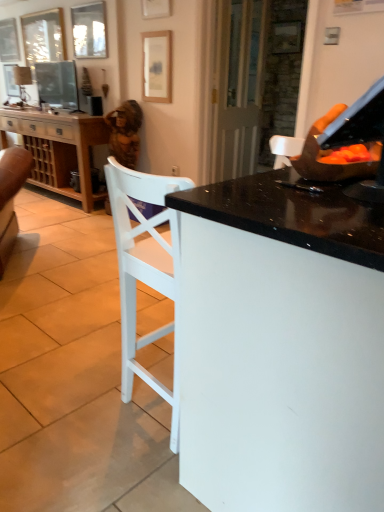
Locate an element on the screen. This screenshot has width=384, height=512. wooden picture frame at upper left, the 1th picture frame from the left is located at coordinates (9, 41).

This screenshot has height=512, width=384. What do you see at coordinates (58, 148) in the screenshot?
I see `wooden cabinet at left` at bounding box center [58, 148].

In order to face matte black television at upper left, should I rotate leftwards or rightwards?

Turn left approximately 17.220 degrees to face it.

What do you see at coordinates (156, 66) in the screenshot? I see `matte wooden picture frame at upper center, the 2th picture frame from the front` at bounding box center [156, 66].

This screenshot has width=384, height=512. What are the coordinates of `wooden picture frame at upper left, the first picture frame positioned from the back` in the screenshot? It's located at pyautogui.click(x=9, y=41).

In the scene shown: Considering the sizes of objects matte wooden picture frame at upper center, the 5th picture frame positioned from the back, and black granite countertop at center in the image provided, who is taller, matte wooden picture frame at upper center, the 5th picture frame positioned from the back, or black granite countertop at center?

With more height is black granite countertop at center.

Which is more to the left, matte wooden picture frame at upper center, marked as the first picture frame in a right-to-left arrangement, or black granite countertop at center?

matte wooden picture frame at upper center, marked as the first picture frame in a right-to-left arrangement.

Considering the points (142, 2) and (296, 182), which point is in front, point (142, 2) or point (296, 182)?

The point (296, 182) is more forward.

From the image's perspective, is matte black pan at upper right positioned above or below beige plastic power outlet at center?

Based on their image positions, matte black pan at upper right is located beneath beige plastic power outlet at center.

Find the location of `power outlet on the left of matte black pan at upper right`. power outlet on the left of matte black pan at upper right is located at coordinates (175, 170).

How many degrees apart are the facing directions of matte black pan at upper right and beige plastic power outlet at center?

The facing directions of matte black pan at upper right and beige plastic power outlet at center are 90.6 degrees apart.

How distant is matte black pan at upper right from beige plastic power outlet at center?

They are 2.59 meters apart.

Would you say matte black pan at upper right contains matte wooden picture frame at upper center, the 5th picture frame positioned from the back?

No, matte wooden picture frame at upper center, the 5th picture frame positioned from the back, is not inside matte black pan at upper right.

Between matte black pan at upper right and matte wooden picture frame at upper center, marked as the first picture frame in a right-to-left arrangement, which one is positioned in front?

matte black pan at upper right is closer to the camera.

Can you confirm if matte black pan at upper right is taller than matte wooden picture frame at upper center, the first picture frame in the front-to-back sequence?

No, matte black pan at upper right is not taller than matte wooden picture frame at upper center, the first picture frame in the front-to-back sequence.

From a real-world perspective, is wooden picture frame at upper left, which is the second picture frame in back-to-front order, over matte wooden picture frame at upper center, the 5th picture frame when ordered from left to right?

No, from a real-world perspective, wooden picture frame at upper left, which is the second picture frame in back-to-front order, is not over matte wooden picture frame at upper center, the 5th picture frame when ordered from left to right

From the image's perspective, which object appears higher, wooden picture frame at upper left, which is the second picture frame in back-to-front order, or matte wooden picture frame at upper center, marked as the first picture frame in a right-to-left arrangement?

wooden picture frame at upper left, which is the second picture frame in back-to-front order, from the image's perspective.

Would you say wooden picture frame at upper left, which is the second picture frame in back-to-front order, is inside or outside matte wooden picture frame at upper center, the 5th picture frame when ordered from left to right?

wooden picture frame at upper left, which is the second picture frame in back-to-front order, lies outside matte wooden picture frame at upper center, the 5th picture frame when ordered from left to right.

Does wooden picture frame at upper left, which is counted as the second picture frame, starting from the left, have a lesser width compared to matte wooden picture frame at upper center, the 5th picture frame positioned from the back?

Incorrect, the width of wooden picture frame at upper left, which is counted as the second picture frame, starting from the left, is not less than that of matte wooden picture frame at upper center, the 5th picture frame positioned from the back.

Is point (316, 130) positioned after point (46, 91)?

No.

Would you say matte black pan at upper right is to the left or to the right of matte black television at upper left in the picture?

matte black pan at upper right is to the right of matte black television at upper left.

From a real-world perspective, is matte black pan at upper right above or below matte black television at upper left?

Clearly, from a real-world perspective, matte black pan at upper right is below matte black television at upper left.

From a real-world perspective, is matte black television at upper left physically below black granite countertop at center?

Actually, matte black television at upper left is physically above black granite countertop at center in the real world.

Find the location of a particular element. The height and width of the screenshot is (512, 384). television above the black granite countertop at center (from a real-world perspective) is located at coordinates (57, 84).

In the scene shown: Are matte black television at upper left and black granite countertop at center far apart?

Yes, matte black television at upper left and black granite countertop at center are quite far apart.

In the scene shown: From the image's perspective, is wooden cabinet at left beneath transparent glass door at center?

Yes, from the image's perspective, wooden cabinet at left is below transparent glass door at center.

Does point (84, 178) lie behind point (240, 170)?

No, it is in front of (240, 170).

Locate an element on the screen. cabinetry below the transparent glass door at center (from a real-world perspective) is located at coordinates (58, 148).

Is the surface of wooden cabinet at left in direct contact with transparent glass door at center?

wooden cabinet at left and transparent glass door at center are not in contact.

The width and height of the screenshot is (384, 512). I want to click on desk that is below the matte wooden picture frame at upper center, the 5th picture frame when ordered from left to right (from the image's perspective), so click(281, 346).

Locate an element on the screen. appliance that appears above the beige plastic power outlet at center (from a real-world perspective) is located at coordinates (319, 149).

From the image, which object appears to be nearer to matte black television at upper left, transparent glass door at center or matte wooden picture frame at upper center, marked as the fourth picture frame in a back-to-front arrangement?

matte wooden picture frame at upper center, marked as the fourth picture frame in a back-to-front arrangement.

From the image, which object appears to be farther from wooden picture frame at upper left, which is counted as the second picture frame, starting from the left, wooden cabinet at left or wooden picture frame at upper left, the first picture frame positioned from the back?

wooden cabinet at left lies further to wooden picture frame at upper left, which is counted as the second picture frame, starting from the left, than the other object.

Estimate the real-world distances between objects in this image. Which object is closer to brown textured statue at upper left, black granite countertop at center or matte black television at upper left?

The object closer to brown textured statue at upper left is matte black television at upper left.

Which object lies further to the anchor point black granite countertop at center, matte white lampshade at upper left or beige plastic power outlet at center?

matte white lampshade at upper left is further to black granite countertop at center.

Considering their positions, is matte black television at upper left positioned further to matte black pan at upper right than matte glass picture frame at upper left, positioned as the third picture frame in left-to-right order?

The object further to matte black pan at upper right is matte black television at upper left.

Which object lies nearer to the anchor point wooden cabinet at left, matte white lampshade at upper left or matte wooden picture frame at upper center, placed as the second picture frame when sorted from right to left?

Based on the image, matte white lampshade at upper left appears to be nearer to wooden cabinet at left.

Considering their positions, is transparent glass door at center positioned further to wooden cabinet at left than matte white lampshade at upper left?

transparent glass door at center.

Estimate the real-world distances between objects in this image. Which object is further from matte wooden picture frame at upper center, marked as the first picture frame in a right-to-left arrangement, beige plastic power outlet at center or transparent glass door at center?

beige plastic power outlet at center is positioned further to the anchor matte wooden picture frame at upper center, marked as the first picture frame in a right-to-left arrangement.

The width and height of the screenshot is (384, 512). In order to click on glass door between matte black pan at upper right and brown textured statue at upper left along the z-axis in this screenshot , I will do `click(238, 86)`.

You are a GUI agent. You are given a task and a screenshot of the screen. Output one action in this format:
    pyautogui.click(x=<x>, y=<y>)
    Task: Click on the television between matte wooden picture frame at upper center, the 5th picture frame when ordered from left to right, and brown textured statue at upper left in the up-down direction
    The image size is (384, 512).
    Given the screenshot: What is the action you would take?
    pyautogui.click(x=57, y=84)

In order to click on television between matte black pan at upper right and matte white lampshade at upper left in the front-back direction in this screenshot , I will do `click(57, 84)`.

Identify the location of cabinetry that lies between matte glass picture frame at upper left, the 3th picture frame when ordered from back to front, and beige plastic power outlet at center from top to bottom. (58, 148).